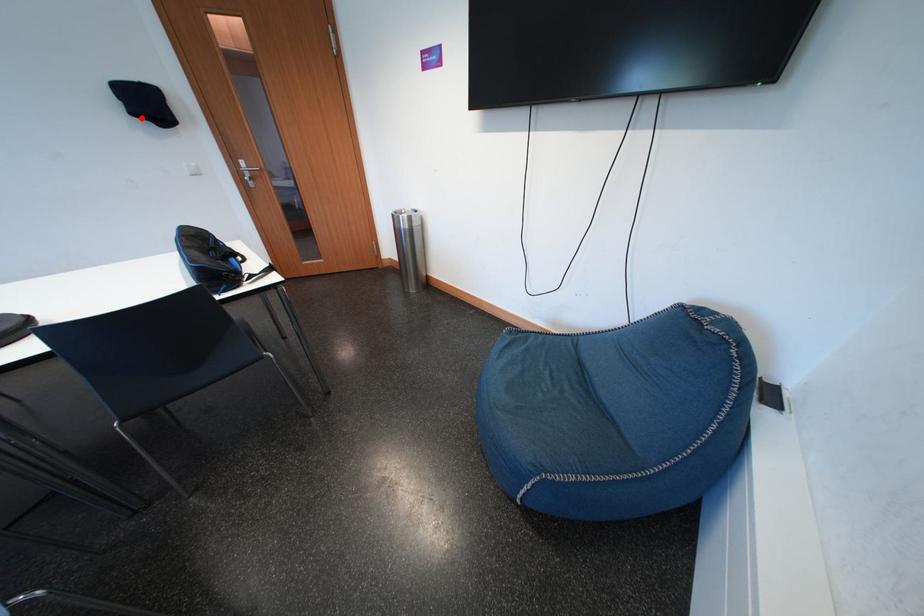
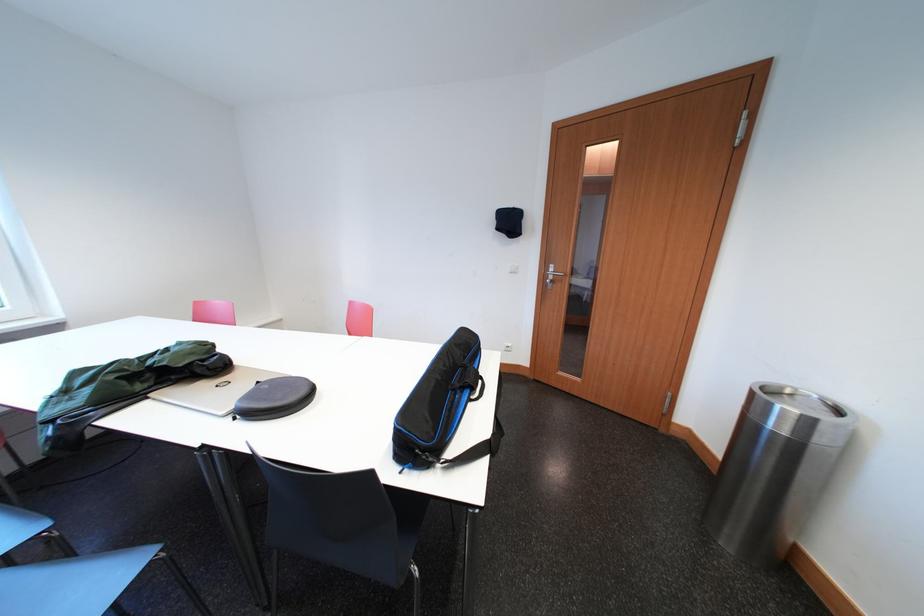
Question: I am providing you with two images of the same scene from different viewpoints. Image1 has a red point marked. In image2, the corresponding 3D location appears at what relative position? Reply with the corresponding letter.

Choices:
 (A) Closer
 (B) Farther

Answer: (A)